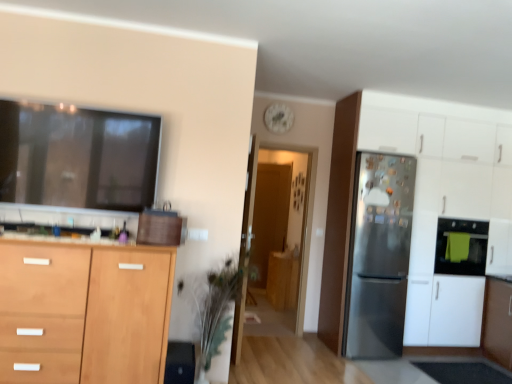
This screenshot has width=512, height=384. In order to click on transparent glass door at center, which is counted as the 1th glass door, starting from the back in this screenshot , I will do `click(269, 218)`.

The image size is (512, 384). What do you see at coordinates (93, 307) in the screenshot?
I see `light wood cabinet at left, arranged as the first cabinetry when viewed from the front` at bounding box center [93, 307].

In order to face green towel oven at right, should I rotate leftwards or rightwards?

Rotate your view right by about 25.675°.

This screenshot has width=512, height=384. What do you see at coordinates (416, 183) in the screenshot?
I see `satin silver refrigerator at right, the 2th cabinetry when ordered from front to back` at bounding box center [416, 183].

You are a GUI agent. You are given a task and a screenshot of the screen. Output one action in this format:
    pyautogui.click(x=<x>, y=<y>)
    Task: Click on the wooden cabinet at lower left
    This screenshot has width=512, height=384.
    Given the screenshot: What is the action you would take?
    (64, 239)

Is point (376, 220) farther from camera compared to point (275, 170)?

No, it is not.

From the image's perspective, is satin silver refrigerator at right positioned above or below transparent glass door at center, marked as the second glass door in a front-to-back arrangement?

Based on their image positions, satin silver refrigerator at right is located beneath transparent glass door at center, marked as the second glass door in a front-to-back arrangement.

Is transparent glass door at center, marked as the second glass door in a front-to-back arrangement, at the back of satin silver refrigerator at right?

Yes, satin silver refrigerator at right's orientation is away from transparent glass door at center, marked as the second glass door in a front-to-back arrangement.

Would you say white matte clock at upper center is to the left or to the right of transparent glass door at center, marked as the second glass door in a front-to-back arrangement, in the picture?

Clearly, white matte clock at upper center is on the right of transparent glass door at center, marked as the second glass door in a front-to-back arrangement, in the image.

From the image's perspective, would you say white matte clock at upper center is shown under transparent glass door at center, marked as the second glass door in a front-to-back arrangement?

No, from the image's perspective, white matte clock at upper center is not below transparent glass door at center, marked as the second glass door in a front-to-back arrangement.

Is white matte clock at upper center directly adjacent to transparent glass door at center, marked as the second glass door in a front-to-back arrangement?

They are not placed beside each other.

Can you confirm if white matte clock at upper center is wider than transparent glass door at center, marked as the second glass door in a front-to-back arrangement?

No, white matte clock at upper center is not wider than transparent glass door at center, marked as the second glass door in a front-to-back arrangement.

How many degrees apart are the facing directions of wooden cabinet at center, which is counted as the 1th cabinetry, starting from the back, and green towel oven at right?

wooden cabinet at center, which is counted as the 1th cabinetry, starting from the back, and green towel oven at right are facing 90 degrees away from each other.

Is wooden cabinet at center, which is counted as the 1th cabinetry, starting from the back, oriented towards green towel oven at right?

No.

From a real-world perspective, who is located lower, wooden cabinet at center, the third cabinetry positioned from the front, or green towel oven at right?

In real-world perspective, wooden cabinet at center, the third cabinetry positioned from the front, is lower.

Can you confirm if wooden cabinet at center, the 2th cabinetry from the right, is taller than green towel oven at right?

Yes, wooden cabinet at center, the 2th cabinetry from the right, is taller than green towel oven at right.

Consider the image. Is green towel oven at right shorter than transparent glass door at center, marked as the second glass door in a front-to-back arrangement?

Correct, green towel oven at right is not as tall as transparent glass door at center, marked as the second glass door in a front-to-back arrangement.

Is green towel oven at right wider or thinner than transparent glass door at center, which is counted as the 1th glass door, starting from the back?

In the image, green towel oven at right appears to be more narrow than transparent glass door at center, which is counted as the 1th glass door, starting from the back.

Considering their positions, is green towel oven at right located in front of or behind transparent glass door at center, which is counted as the 1th glass door, starting from the back?

green towel oven at right is in front of transparent glass door at center, which is counted as the 1th glass door, starting from the back.

At what (x,y) coordinates should I click in order to perform the action: click on appliance that is in front of the transparent glass door at center, marked as the second glass door in a front-to-back arrangement. Please return your answer as a coordinate pair (x, y). This screenshot has width=512, height=384. Looking at the image, I should click on (468, 247).

Based on the photo, is green leafy plant at center far away from transparent glass door at center, which ranks as the second glass door in back-to-front order?

green leafy plant at center is far away from transparent glass door at center, which ranks as the second glass door in back-to-front order.

From the image's perspective, which is below, green leafy plant at center or transparent glass door at center, acting as the first glass door starting from the front?

green leafy plant at center appears lower in the image.

Considering the positions of point (195, 302) and point (280, 259), is point (195, 302) closer or farther from the camera than point (280, 259)?

Point (195, 302) is positioned closer to the camera compared to point (280, 259).

Is satin silver refrigerator at right, the 2th cabinetry when ordered from front to back, turned away from green leafy plant at center?

No, satin silver refrigerator at right, the 2th cabinetry when ordered from front to back, is not facing away from green leafy plant at center.

From the image's perspective, relative to green leafy plant at center, is satin silver refrigerator at right, positioned as the second cabinetry in back-to-front order, above or below?

Based on their image positions, satin silver refrigerator at right, positioned as the second cabinetry in back-to-front order, is located above green leafy plant at center.

Starting from the green leafy plant at center, which cabinetry is the 2nd one to the right? Please provide its 2D coordinates.

[(416, 183)]

Is the position of light wood cabinet at left, acting as the first cabinetry starting from the left, more distant than that of wooden cabinet at center, which is counted as the 1th cabinetry, starting from the back?

No, it is not.

From the picture: Can wooden cabinet at center, which ranks as the 2th cabinetry in left-to-right order, be found inside light wood cabinet at left, the third cabinetry from the back?

Actually, wooden cabinet at center, which ranks as the 2th cabinetry in left-to-right order, is outside light wood cabinet at left, the third cabinetry from the back.

Can you see light wood cabinet at left, acting as the first cabinetry starting from the left, touching wooden cabinet at center, the third cabinetry positioned from the front?

light wood cabinet at left, acting as the first cabinetry starting from the left, is not next to wooden cabinet at center, the third cabinetry positioned from the front, and they're not touching.

From the image's perspective, who appears lower, light wood cabinet at left, acting as the 3th cabinetry starting from the right, or wooden cabinet at center, which ranks as the 2th cabinetry in left-to-right order?

From the image's view, wooden cabinet at center, which ranks as the 2th cabinetry in left-to-right order, is below.

You are a GUI agent. You are given a task and a screenshot of the screen. Output one action in this format:
    pyautogui.click(x=<x>, y=<y>)
    Task: Click on the 2nd glass door to the left of the satin silver refrigerator at right, starting your count from the anchor
    Image resolution: width=512 pixels, height=384 pixels.
    Given the screenshot: What is the action you would take?
    pyautogui.click(x=269, y=218)

The height and width of the screenshot is (384, 512). There is a transparent glass door at center, which is counted as the 1th glass door, starting from the back. Identify the location of clock above it (from a real-world perspective). (278, 118).

From the image, which object appears to be nearer to transparent glass door at center, marked as the second glass door in a front-to-back arrangement, light wood cabinet at left, the third cabinetry from the back, or satin silver refrigerator at right?

The object closer to transparent glass door at center, marked as the second glass door in a front-to-back arrangement, is satin silver refrigerator at right.

Considering their positions, is satin silver refrigerator at right positioned closer to green towel oven at right than transparent glass door at center, marked as the second glass door in a front-to-back arrangement?

satin silver refrigerator at right.

When comparing their distances from satin silver refrigerator at right, which is the 3th cabinetry in left-to-right order, does satin silver refrigerator at right or transparent glass door at center, which ranks as the second glass door in back-to-front order, seem closer?

Based on the image, satin silver refrigerator at right appears to be nearer to satin silver refrigerator at right, which is the 3th cabinetry in left-to-right order.

Considering their positions, is transparent glass door at center, which is counted as the 1th glass door, starting from the back, positioned further to satin silver refrigerator at right, positioned as the second cabinetry in back-to-front order, than wooden cabinet at center, the third cabinetry positioned from the front?

The object further to satin silver refrigerator at right, positioned as the second cabinetry in back-to-front order, is transparent glass door at center, which is counted as the 1th glass door, starting from the back.

Estimate the real-world distances between objects in this image. Which object is further from green leafy plant at center, wooden cabinet at lower left or transparent glass door at center, which ranks as the second glass door in back-to-front order?

The object further to green leafy plant at center is transparent glass door at center, which ranks as the second glass door in back-to-front order.

From the image, which object appears to be farther from satin silver refrigerator at right, which is the 3th cabinetry in left-to-right order, white matte clock at upper center or transparent glass door at center, which ranks as the second glass door in back-to-front order?

white matte clock at upper center lies further to satin silver refrigerator at right, which is the 3th cabinetry in left-to-right order, than the other object.

From the image, which object appears to be farther from light wood cabinet at left, arranged as the first cabinetry when viewed from the front, satin silver refrigerator at right, the 2th cabinetry when ordered from front to back, or transparent glass door at center, acting as the first glass door starting from the front?

transparent glass door at center, acting as the first glass door starting from the front, lies further to light wood cabinet at left, arranged as the first cabinetry when viewed from the front, than the other object.

Considering their positions, is satin silver refrigerator at right, which is the 3th cabinetry in left-to-right order, positioned further to white matte clock at upper center than green towel oven at right?

green towel oven at right lies further to white matte clock at upper center than the other object.

Locate an element on the screen. clock between transparent glass door at center, acting as the first glass door starting from the front, and satin silver refrigerator at right, the first cabinetry positioned from the right, in the horizontal direction is located at coordinates (278, 118).

Where is `cabinetry between green leafy plant at center and wooden cabinet at center, which is counted as the 1th cabinetry, starting from the back, in the front-back direction`? The height and width of the screenshot is (384, 512). cabinetry between green leafy plant at center and wooden cabinet at center, which is counted as the 1th cabinetry, starting from the back, in the front-back direction is located at coordinates (416, 183).

Locate an element on the screen. refrigerator between green leafy plant at center and transparent glass door at center, marked as the second glass door in a front-to-back arrangement, from front to back is located at coordinates (378, 255).

Locate an element on the screen. plant between wooden cabinet at lower left and satin silver refrigerator at right, the 2th cabinetry when ordered from front to back is located at coordinates (x=216, y=310).